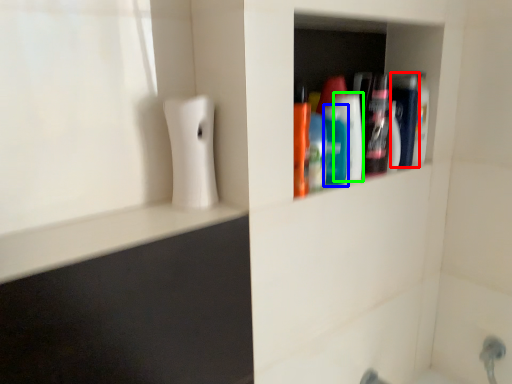
Question: Which object is positioned farthest from mouthwash (highlighted by a red box)? Select from mouthwash (highlighted by a blue box) and mouthwash (highlighted by a green box).

Choices:
 (A) mouthwash
 (B) mouthwash

Answer: (A)